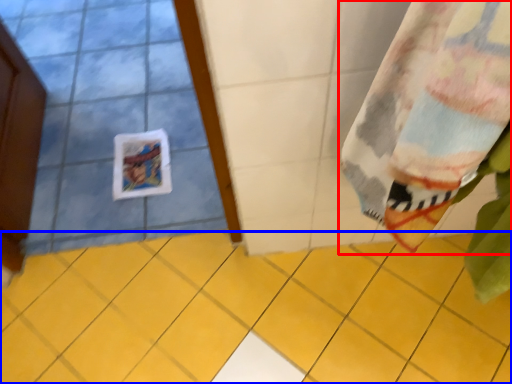
Question: Which point is further to the camera, curtain (highlighted by a red box) or ceramic tile (highlighted by a blue box)?

Choices:
 (A) curtain
 (B) ceramic tile

Answer: (B)